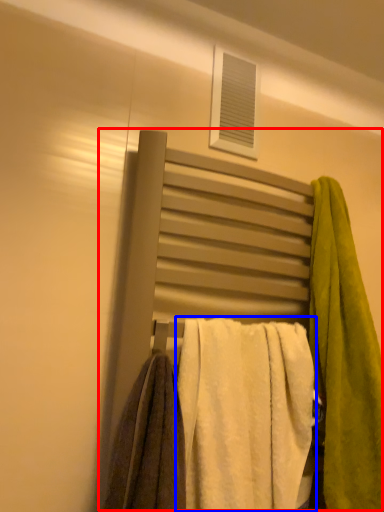
Question: Among these objects, which one is farthest to the camera, bed (highlighted by a red box) or towel (highlighted by a blue box)?

Choices:
 (A) bed
 (B) towel

Answer: (A)